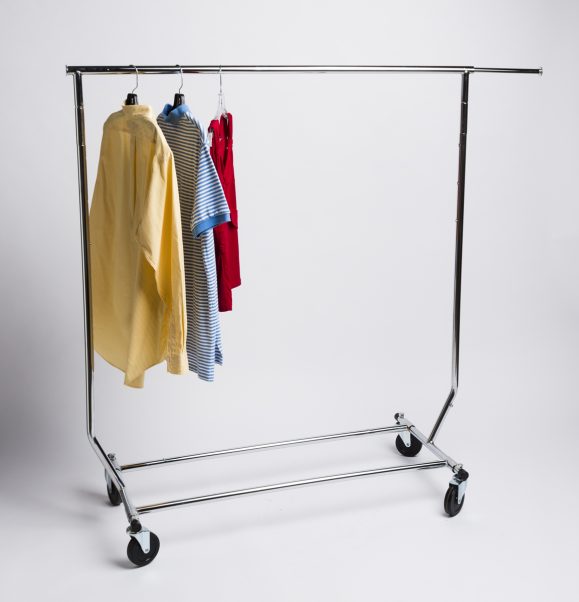
Locate an element on the screen. The image size is (579, 602). black swivel wheels is located at coordinates (450, 504), (416, 444), (131, 550), (113, 497).